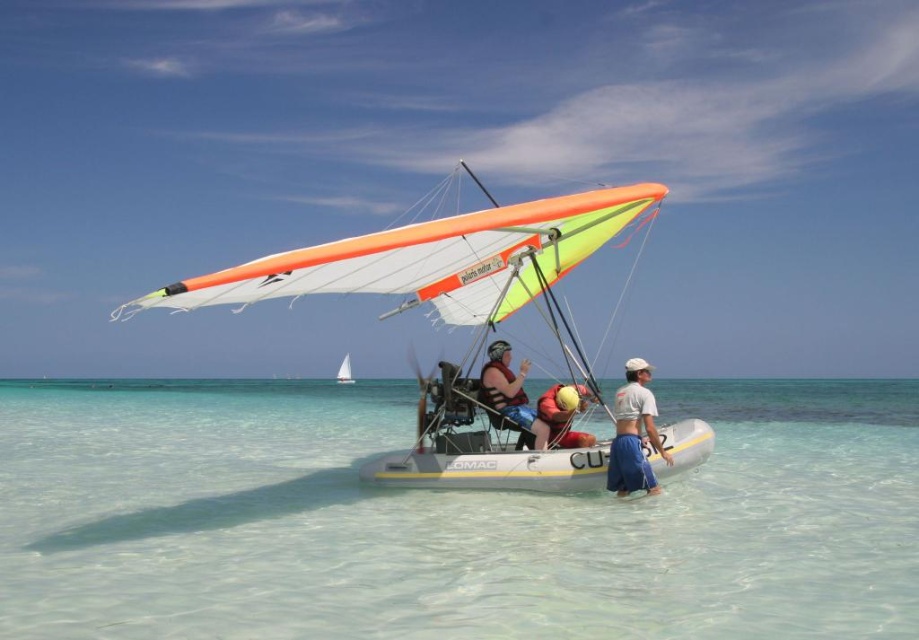
Question: Is yellow fabric helmet at center wider than white sail at center?

Choices:
 (A) no
 (B) yes

Answer: (A)

Question: Is yellow rubber boat at center further to the viewer compared to orange life vest at center?

Choices:
 (A) yes
 (B) no

Answer: (B)

Question: Which of these objects is positioned closest to the yellow rubber boat at center?

Choices:
 (A) orange life vest at center
 (B) white cotton shirt at center

Answer: (A)

Question: Considering the relative positions of clear plastic water at center and yellow rubber boat at center in the image provided, where is clear plastic water at center located with respect to yellow rubber boat at center?

Choices:
 (A) left
 (B) right

Answer: (B)

Question: Among these points, which one is farthest from the camera?

Choices:
 (A) (614, 448)
 (B) (347, 376)
 (C) (509, 397)

Answer: (B)

Question: Which of the following is the farthest from the observer?

Choices:
 (A) (253, 605)
 (B) (464, 476)

Answer: (B)